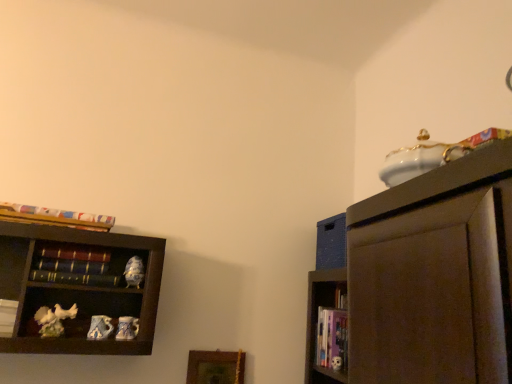
Question: Is wooden picture frame at lower center taller or shorter than white matte book at left, the second book in the bottom-to-top sequence?

Choices:
 (A) tall
 (B) short

Answer: (A)

Question: Would you say wooden picture frame at lower center is to the left or to the right of white matte book at left, which ranks as the 4th book in top-to-bottom order, in the picture?

Choices:
 (A) left
 (B) right

Answer: (B)

Question: Which is nearer to the porcelain figurine at left, which ranks as the 3th toy in bottom-to-top order?

Choices:
 (A) wooden picture frame at lower center
 (B) matte ceramic bird at lower left, which ranks as the second toy in bottom-to-top order
 (C) hardcover book at left, the third book from the top
 (D) porcelain mug at lower left, which is counted as the 3th toy, starting from the top
 (E) hardcover books at left, marked as the 2th book in a top-to-bottom arrangement

Answer: (C)

Question: Based on their relative distances, which object is farther from the matte ceramic bird at lower left, which ranks as the second toy in bottom-to-top order?

Choices:
 (A) wooden picture frame at lower center
 (B) hardcover books at left, which ranks as the third book in right-to-left order
 (C) multicolored paper at upper left, arranged as the 1th book when viewed from the top
 (D) hardcover book at lower right, which appears as the 1th book when ordered from the bottom
 (E) porcelain figurine at left, which ranks as the 3th toy in bottom-to-top order

Answer: (D)